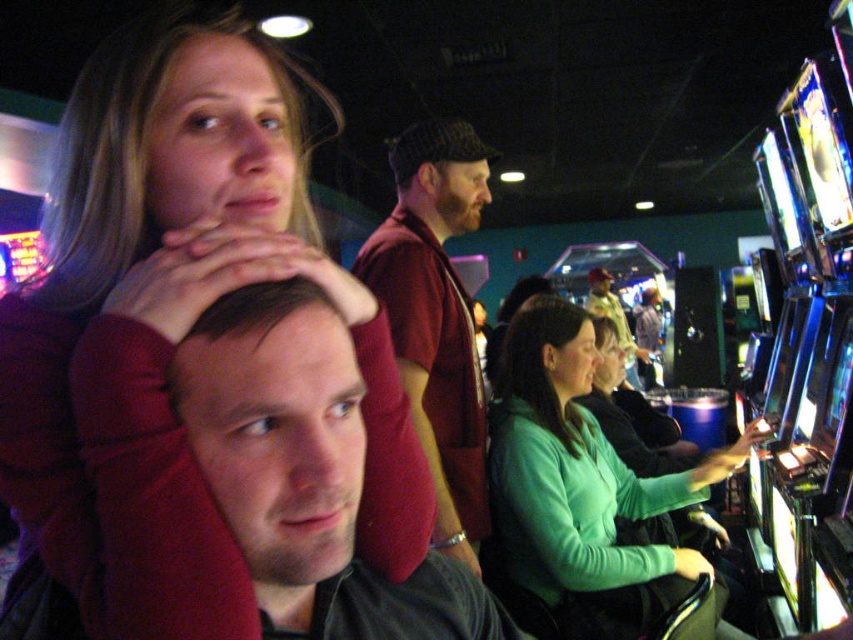
Identify the location of smooth red shirt at upper left. (143, 324).

Does smooth red shirt at upper left appear under matte black shirt at center?

No, smooth red shirt at upper left is not below matte black shirt at center.

This screenshot has width=853, height=640. Describe the element at coordinates (143, 324) in the screenshot. I see `smooth red shirt at upper left` at that location.

Identify the location of smooth red shirt at upper left. 143,324.

Is smooth red shirt at upper left further to camera compared to maroon sweater at center?

No, it is in front of maroon sweater at center.

Does smooth red shirt at upper left have a smaller size compared to maroon sweater at center?

Yes, smooth red shirt at upper left is smaller than maroon sweater at center.

Is point (190, 108) more distant than point (434, 545)?

No.

The image size is (853, 640). What are the coordinates of `smooth red shirt at upper left` in the screenshot? It's located at (143, 324).

Based on the photo, who is more forward, (422,576) or (450,438)?

Point (422,576) is more forward.

Image resolution: width=853 pixels, height=640 pixels. I want to click on matte black shirt at center, so click(x=306, y=474).

Locate an element on the screen. matte black shirt at center is located at coordinates (306, 474).